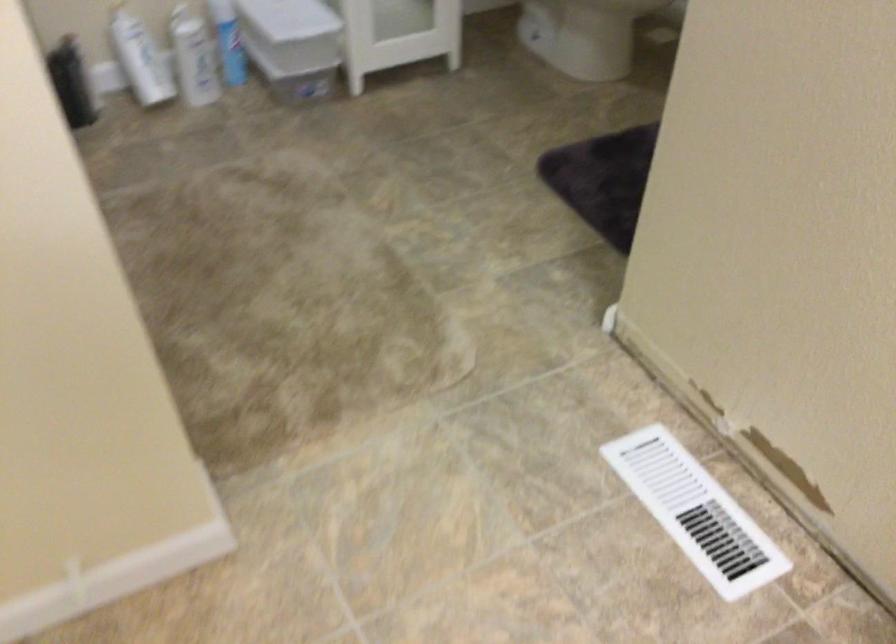
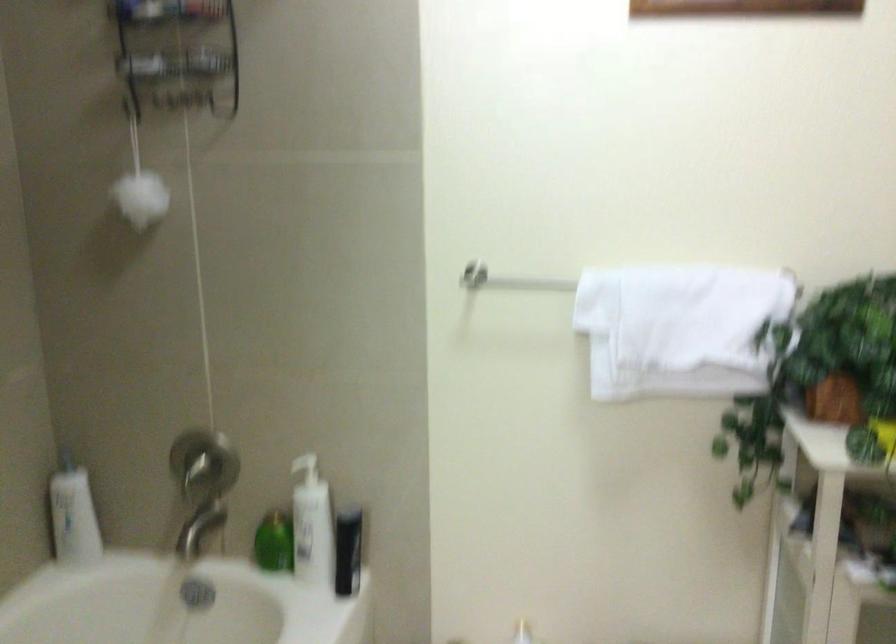
Based on the photo, how did the camera likely rotate?

The camera rotated toward left-up.